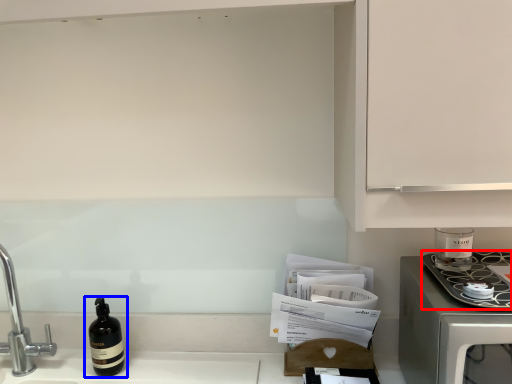
Question: Which point is closer to the camera, kitchen appliance (highlighted by a red box) or bottle (highlighted by a blue box)?

Choices:
 (A) kitchen appliance
 (B) bottle

Answer: (A)